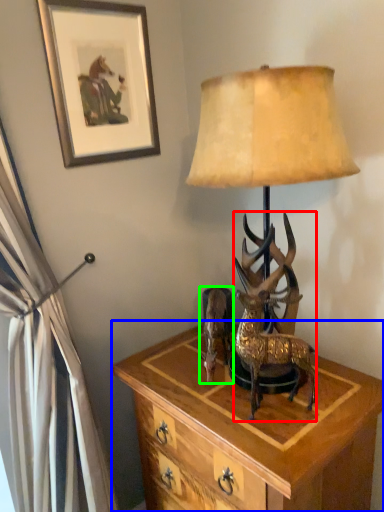
Question: Which object is the farthest from deer (highlighted by a red box)? Choose among these: nightstand (highlighted by a blue box) or reindeer (highlighted by a green box).

Choices:
 (A) nightstand
 (B) reindeer

Answer: (A)